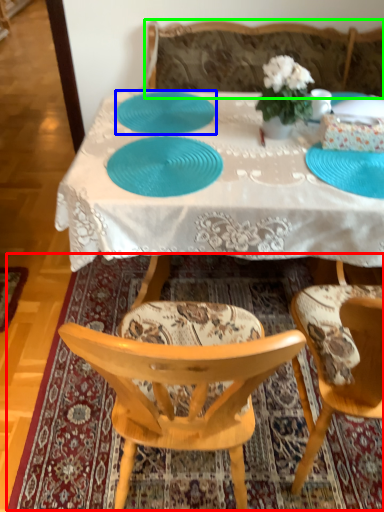
Question: Considering the real-world distances, which object is farthest from mat (highlighted by a red box)? plate (highlighted by a blue box) or studio couch (highlighted by a green box)?

Choices:
 (A) plate
 (B) studio couch

Answer: (B)